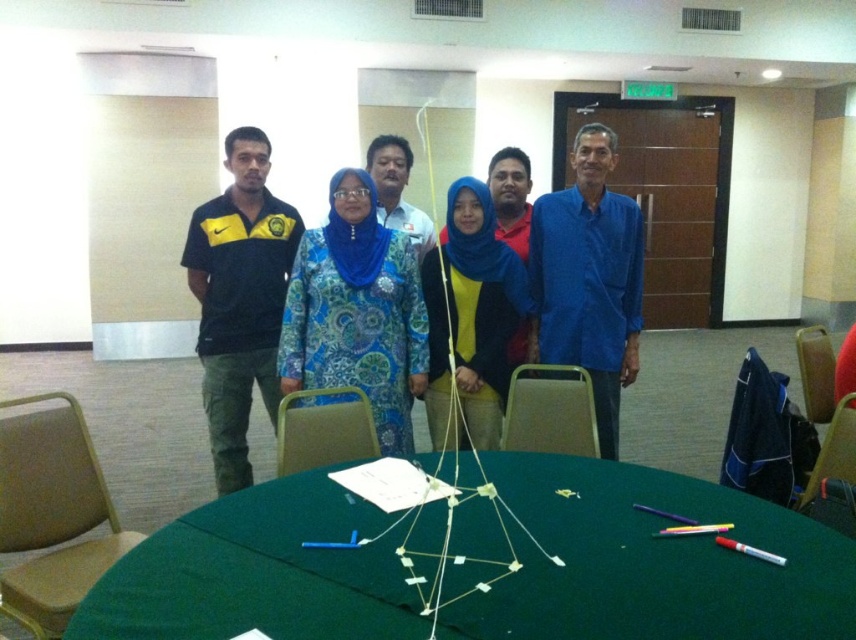
Question: Can you confirm if green fabric table at center is positioned above blue matte shirt at center?

Choices:
 (A) no
 (B) yes

Answer: (A)

Question: Estimate the real-world distances between objects in this image. Which object is closer to the blue printed dress at center?

Choices:
 (A) green fabric table at center
 (B) matte black polo shirt at left

Answer: (B)

Question: Can you confirm if blue printed dress at center is smaller than blue matte shirt at center?

Choices:
 (A) no
 (B) yes

Answer: (B)

Question: Considering the real-world distances, which object is closest to the blue printed dress at center?

Choices:
 (A) blue matte shirt at center
 (B) matte black polo shirt at left

Answer: (B)

Question: Estimate the real-world distances between objects in this image. Which object is farther from the blue matte shirt at center?

Choices:
 (A) green fabric table at center
 (B) blue printed dress at center

Answer: (A)

Question: In this image, where is matte black polo shirt at left located relative to blue matte shirt at center?

Choices:
 (A) right
 (B) left

Answer: (B)